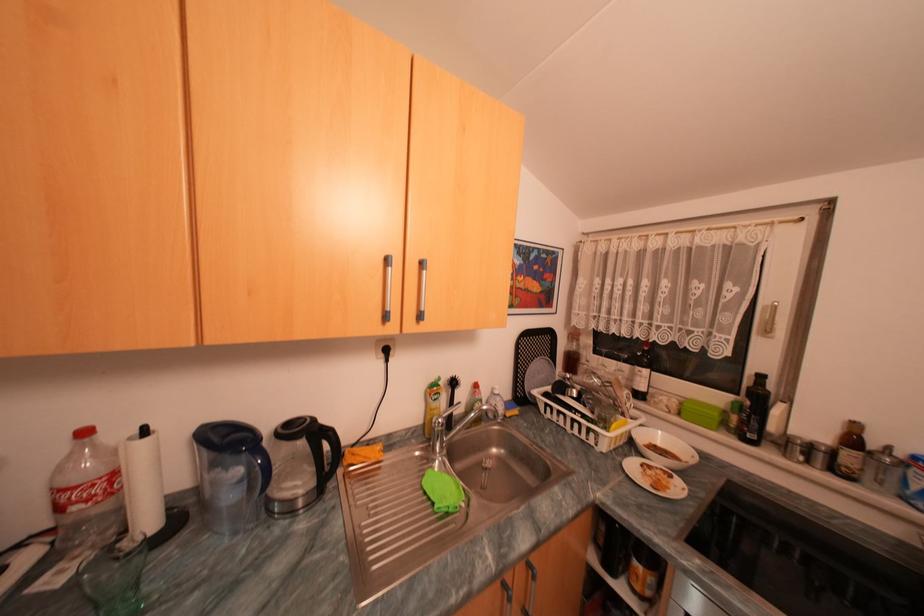
You are a GUI agent. You are given a task and a screenshot of the screen. Output one action in this format:
    pyautogui.click(x=<x>, y=<y>)
    Task: Click on the white window handle
    Image resolution: width=924 pixels, height=616 pixels.
    Given the screenshot: What is the action you would take?
    pyautogui.click(x=768, y=320)